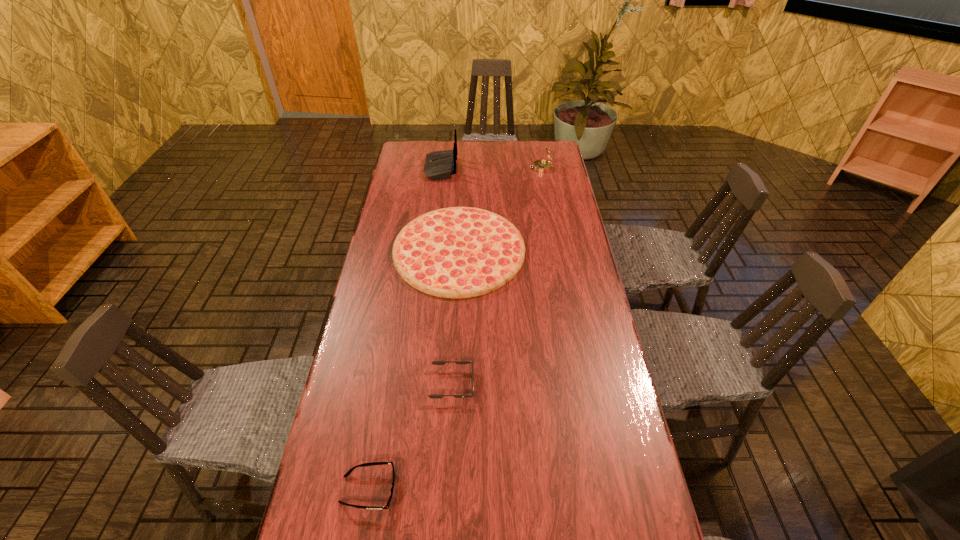
Find the location of `router`. router is located at coordinates (439, 165).

The height and width of the screenshot is (540, 960). In order to click on the fourth shortest object in this screenshot , I will do `click(542, 166)`.

The width and height of the screenshot is (960, 540). Find the location of `compass`. compass is located at coordinates (542, 166).

Where is `the right sunglasses`? Image resolution: width=960 pixels, height=540 pixels. the right sunglasses is located at coordinates (434, 396).

Locate an element on the screen. The image size is (960, 540). the fourth farthest object is located at coordinates (434, 396).

Where is `the third nearest object`? The height and width of the screenshot is (540, 960). the third nearest object is located at coordinates (458, 252).

You are a GUI agent. You are given a task and a screenshot of the screen. Output one action in this format:
    pyautogui.click(x=<x>, y=<y>)
    Task: Click on the left sunglasses
    
    Given the screenshot: What is the action you would take?
    pyautogui.click(x=348, y=473)

Find the location of `the nearer sunglasses`. the nearer sunglasses is located at coordinates (348, 473).

The height and width of the screenshot is (540, 960). In order to click on free space located on the back of the tallest object in this screenshot , I will do `click(497, 168)`.

Locate an element on the screen. The height and width of the screenshot is (540, 960). free space located 0.370m with the dial facing the second tallest object is located at coordinates (446, 168).